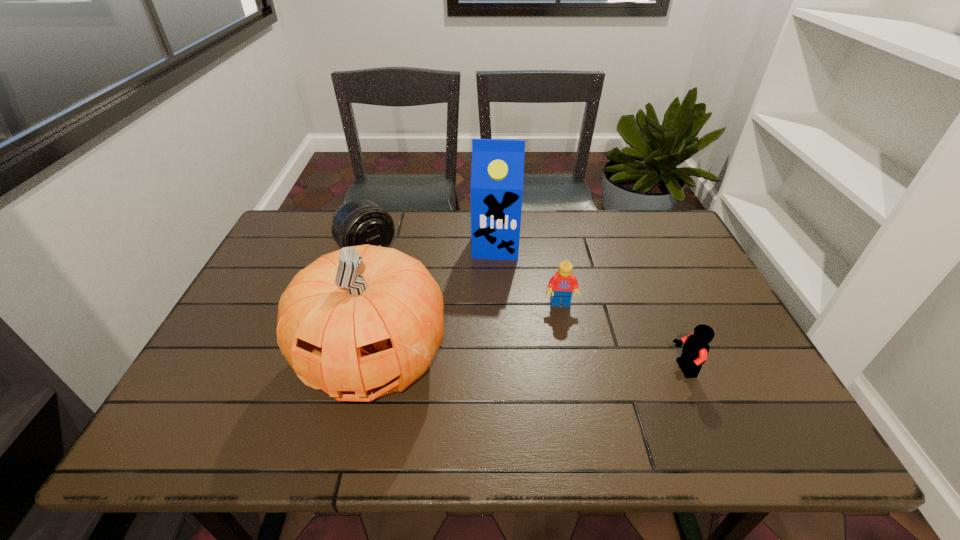
This screenshot has height=540, width=960. I want to click on vacant space on the desktop that is between the pumpkin and the right Lego and is positioned with the cap open on the carton, so click(488, 363).

Where is `vacant space on the desktop that is between the pumpkin and the right Lego and is positioned on the face of the farther Lego`? This screenshot has width=960, height=540. vacant space on the desktop that is between the pumpkin and the right Lego and is positioned on the face of the farther Lego is located at coordinates (568, 366).

Where is `vacant spot on the desktop that is between the pumpkin and the right Lego and is positioned on the front-facing side of the telephoto lens`? vacant spot on the desktop that is between the pumpkin and the right Lego and is positioned on the front-facing side of the telephoto lens is located at coordinates (489, 363).